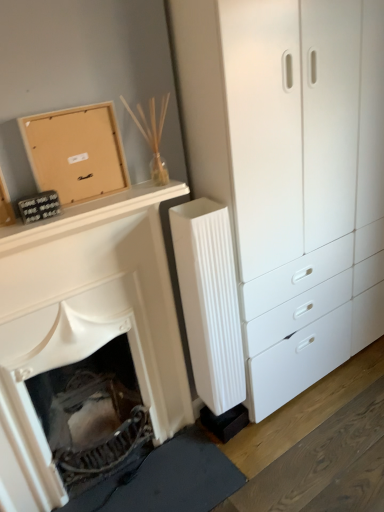
Identify the location of vacant area located to the right-hand side of white ribbed radiator at center. (268, 433).